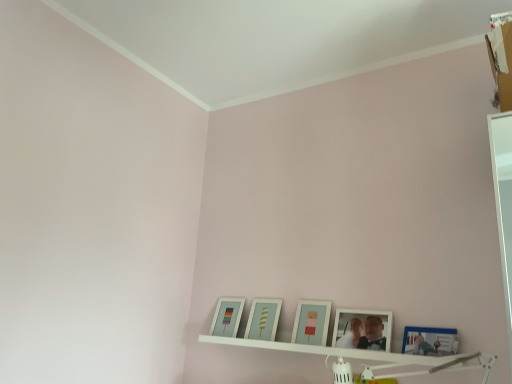
What do you see at coordinates (373, 357) in the screenshot? The width and height of the screenshot is (512, 384). I see `white wooden shelf at lower center` at bounding box center [373, 357].

Measure the distance between point (230, 308) and camera.

Point (230, 308) is 2.11 meters away from camera.

At what (x,y) coordinates should I click in order to perform the action: click on matte white picture frame at center, which is the second picture frame from left to right. Please return your answer as a coordinate pair (x, y). The image size is (512, 384). Looking at the image, I should click on (263, 319).

From a real-world perspective, which object rests below the other?

In real-world perspective, white wooden shelf at lower center is lower.

Can you see matte blue picture frame at center, which appears as the 3th picture frame when viewed from the right, touching white wooden shelf at lower center?

They are not placed beside each other.

Considering the sizes of objects matte blue picture frame at center, marked as the 3th picture frame in a left-to-right arrangement, and white wooden shelf at lower center in the image provided, who is taller, matte blue picture frame at center, marked as the 3th picture frame in a left-to-right arrangement, or white wooden shelf at lower center?

matte blue picture frame at center, marked as the 3th picture frame in a left-to-right arrangement, is taller.

This screenshot has width=512, height=384. I want to click on shelf beneath the matte blue picture frame at center, marked as the 3th picture frame in a left-to-right arrangement (from a real-world perspective), so click(x=373, y=357).

Are white wooden shelf at lower center and matte white picture frame at center, placed as the fourth picture frame when sorted from right to left, beside each other?

There is a gap between white wooden shelf at lower center and matte white picture frame at center, placed as the fourth picture frame when sorted from right to left.

From the white wooden shelf at lower center, count 4th picture frames backward and point to it. Please provide its 2D coordinates.

[(263, 319)]

Would you say white wooden shelf at lower center is inside or outside matte white picture frame at center, which is the second picture frame from left to right?

The correct answer is: outside.

From the image's perspective, is white wooden shelf at lower center above matte white picture frame at center, which is the second picture frame from left to right?

No, from the image's perspective, white wooden shelf at lower center is not over matte white picture frame at center, which is the second picture frame from left to right.

At what (x,y) coordinates should I click in order to perform the action: click on the 1st picture frame above the matte white picture frame at center, placed as the fourth picture frame when sorted from right to left (from the image's perspective). Please return your answer as a coordinate pair (x, y). This screenshot has height=384, width=512. Looking at the image, I should click on (311, 322).

From the picture: Who is bigger, matte blue picture frame at center, marked as the 3th picture frame in a left-to-right arrangement, or matte white picture frame at center, which is the second picture frame from left to right?

Bigger between the two is matte white picture frame at center, which is the second picture frame from left to right.

From a real-world perspective, who is located lower, matte blue picture frame at center, which appears as the 3th picture frame when viewed from the right, or matte white picture frame at center, placed as the fourth picture frame when sorted from right to left?

In real-world perspective, matte white picture frame at center, placed as the fourth picture frame when sorted from right to left, is lower.

Is matte blue picture frame at center, which appears as the 3th picture frame when viewed from the right, thinner than matte white picture frame at center, placed as the fourth picture frame when sorted from right to left?

Yes.

From a real-world perspective, which object stands above the other?

From a 3D spatial view, matte glass picture frame at lower left, which is counted as the 5th picture frame, starting from the right, is above.

Is blue glossy picture frame at lower right, which is the 1th picture frame in right-to-left order, looking in the opposite direction of matte glass picture frame at lower left, the 1th picture frame in the left-to-right sequence?

No, blue glossy picture frame at lower right, which is the 1th picture frame in right-to-left order, is not facing the opposite direction of matte glass picture frame at lower left, the 1th picture frame in the left-to-right sequence.

Are blue glossy picture frame at lower right, which ranks as the 5th picture frame in left-to-right order, and matte glass picture frame at lower left, which is counted as the 5th picture frame, starting from the right, making contact?

blue glossy picture frame at lower right, which ranks as the 5th picture frame in left-to-right order, and matte glass picture frame at lower left, which is counted as the 5th picture frame, starting from the right, are clearly separated.

Where is `the 4th picture frame behind the blue glossy picture frame at lower right, which ranks as the 5th picture frame in left-to-right order, counting from the anchor's position`? the 4th picture frame behind the blue glossy picture frame at lower right, which ranks as the 5th picture frame in left-to-right order, counting from the anchor's position is located at coordinates (227, 316).

Between white matte picture frame at lower center, positioned as the fourth picture frame in left-to-right order, and blue glossy picture frame at lower right, which ranks as the 5th picture frame in left-to-right order, which one appears on the right side from the viewer's perspective?

blue glossy picture frame at lower right, which ranks as the 5th picture frame in left-to-right order, is more to the right.

This screenshot has width=512, height=384. Find the location of `the 1st picture frame to the left of the blue glossy picture frame at lower right, which is the 1th picture frame in right-to-left order, starting your count from the anchor`. the 1st picture frame to the left of the blue glossy picture frame at lower right, which is the 1th picture frame in right-to-left order, starting your count from the anchor is located at coordinates (362, 330).

Considering the points (341, 309) and (447, 338), which point is behind, point (341, 309) or point (447, 338)?

The point (341, 309) is farther.

Is blue glossy picture frame at lower right, which ranks as the 5th picture frame in left-to-right order, bigger than matte blue picture frame at center, which appears as the 3th picture frame when viewed from the right?

No, blue glossy picture frame at lower right, which ranks as the 5th picture frame in left-to-right order, is not bigger than matte blue picture frame at center, which appears as the 3th picture frame when viewed from the right.

Considering the relative sizes of blue glossy picture frame at lower right, which is the 1th picture frame in right-to-left order, and matte blue picture frame at center, marked as the 3th picture frame in a left-to-right arrangement, in the image provided, is blue glossy picture frame at lower right, which is the 1th picture frame in right-to-left order, shorter than matte blue picture frame at center, marked as the 3th picture frame in a left-to-right arrangement,?

Yes, blue glossy picture frame at lower right, which is the 1th picture frame in right-to-left order, is shorter than matte blue picture frame at center, marked as the 3th picture frame in a left-to-right arrangement.

From the image's perspective, is blue glossy picture frame at lower right, which ranks as the 5th picture frame in left-to-right order, beneath matte blue picture frame at center, marked as the 3th picture frame in a left-to-right arrangement?

Incorrect, from the image's perspective, blue glossy picture frame at lower right, which ranks as the 5th picture frame in left-to-right order, is higher than matte blue picture frame at center, marked as the 3th picture frame in a left-to-right arrangement.

Which object is positioned more to the left, white matte picture frame at lower center, positioned as the fourth picture frame in left-to-right order, or matte white picture frame at center, which is the second picture frame from left to right?

matte white picture frame at center, which is the second picture frame from left to right, is more to the left.

Locate an element on the screen. the 3rd picture frame above the matte white picture frame at center, placed as the fourth picture frame when sorted from right to left (from the image's perspective) is located at coordinates (362, 330).

Considering the sizes of objects white matte picture frame at lower center, positioned as the fourth picture frame in left-to-right order, and matte white picture frame at center, placed as the fourth picture frame when sorted from right to left, in the image provided, who is taller, white matte picture frame at lower center, positioned as the fourth picture frame in left-to-right order, or matte white picture frame at center, placed as the fourth picture frame when sorted from right to left,?

Standing taller between the two is matte white picture frame at center, placed as the fourth picture frame when sorted from right to left.

Starting from the white wooden shelf at lower center, which picture frame is the 3rd one behind? Please provide its 2D coordinates.

[(311, 322)]

The image size is (512, 384). In order to click on shelf in front of the matte white picture frame at center, placed as the fourth picture frame when sorted from right to left in this screenshot , I will do `click(373, 357)`.

From the image, which object appears to be nearer to matte white picture frame at center, which is the second picture frame from left to right, matte blue picture frame at center, which appears as the 3th picture frame when viewed from the right, or white matte picture frame at lower center, positioned as the fourth picture frame in left-to-right order?

The object closer to matte white picture frame at center, which is the second picture frame from left to right, is matte blue picture frame at center, which appears as the 3th picture frame when viewed from the right.

Estimate the real-world distances between objects in this image. Which object is further from matte blue picture frame at center, which appears as the 3th picture frame when viewed from the right, matte glass picture frame at lower left, the 1th picture frame in the left-to-right sequence, or white matte picture frame at lower center, positioned as the fourth picture frame in left-to-right order?

matte glass picture frame at lower left, the 1th picture frame in the left-to-right sequence, is positioned further to the anchor matte blue picture frame at center, which appears as the 3th picture frame when viewed from the right.

Which object lies further to the anchor point matte glass picture frame at lower left, which is counted as the 5th picture frame, starting from the right, blue glossy picture frame at lower right, which ranks as the 5th picture frame in left-to-right order, or white matte picture frame at lower center, positioned as the fourth picture frame in left-to-right order?

blue glossy picture frame at lower right, which ranks as the 5th picture frame in left-to-right order, lies further to matte glass picture frame at lower left, which is counted as the 5th picture frame, starting from the right, than the other object.

Based on their spatial positions, is white matte picture frame at lower center, positioned as the fourth picture frame in left-to-right order, or blue glossy picture frame at lower right, which is the 1th picture frame in right-to-left order, closer to matte glass picture frame at lower left, which is counted as the 5th picture frame, starting from the right?

The object closer to matte glass picture frame at lower left, which is counted as the 5th picture frame, starting from the right, is white matte picture frame at lower center, positioned as the fourth picture frame in left-to-right order.

When comparing their distances from white matte picture frame at lower center, placed as the second picture frame when sorted from right to left, does matte blue picture frame at center, which appears as the 3th picture frame when viewed from the right, or white wooden shelf at lower center seem closer?

The object closer to white matte picture frame at lower center, placed as the second picture frame when sorted from right to left, is white wooden shelf at lower center.

Estimate the real-world distances between objects in this image. Which object is closer to white wooden shelf at lower center, white matte picture frame at lower center, placed as the second picture frame when sorted from right to left, or matte white picture frame at center, which is the second picture frame from left to right?

Based on the image, white matte picture frame at lower center, placed as the second picture frame when sorted from right to left, appears to be nearer to white wooden shelf at lower center.

Estimate the real-world distances between objects in this image. Which object is further from matte blue picture frame at center, marked as the 3th picture frame in a left-to-right arrangement, white wooden shelf at lower center or matte glass picture frame at lower left, which is counted as the 5th picture frame, starting from the right?

matte glass picture frame at lower left, which is counted as the 5th picture frame, starting from the right, is further to matte blue picture frame at center, marked as the 3th picture frame in a left-to-right arrangement.

Looking at the image, which one is located closer to white matte picture frame at lower center, placed as the second picture frame when sorted from right to left, blue glossy picture frame at lower right, which ranks as the 5th picture frame in left-to-right order, or matte white picture frame at center, which is the second picture frame from left to right?

blue glossy picture frame at lower right, which ranks as the 5th picture frame in left-to-right order, lies closer to white matte picture frame at lower center, placed as the second picture frame when sorted from right to left, than the other object.

Identify the location of shelf between matte glass picture frame at lower left, the 1th picture frame in the left-to-right sequence, and white matte picture frame at lower center, placed as the second picture frame when sorted from right to left. Image resolution: width=512 pixels, height=384 pixels. (373, 357).

Where is `shelf between matte white picture frame at center, placed as the fourth picture frame when sorted from right to left, and blue glossy picture frame at lower right, which is the 1th picture frame in right-to-left order, from left to right`? The image size is (512, 384). shelf between matte white picture frame at center, placed as the fourth picture frame when sorted from right to left, and blue glossy picture frame at lower right, which is the 1th picture frame in right-to-left order, from left to right is located at coordinates (x=373, y=357).

Locate an element on the screen. picture frame located between matte blue picture frame at center, marked as the 3th picture frame in a left-to-right arrangement, and blue glossy picture frame at lower right, which is the 1th picture frame in right-to-left order, in the left-right direction is located at coordinates (362, 330).

Where is `picture frame located between matte glass picture frame at lower left, which is counted as the 5th picture frame, starting from the right, and matte blue picture frame at center, marked as the 3th picture frame in a left-to-right arrangement, in the left-right direction`? Image resolution: width=512 pixels, height=384 pixels. picture frame located between matte glass picture frame at lower left, which is counted as the 5th picture frame, starting from the right, and matte blue picture frame at center, marked as the 3th picture frame in a left-to-right arrangement, in the left-right direction is located at coordinates (263, 319).